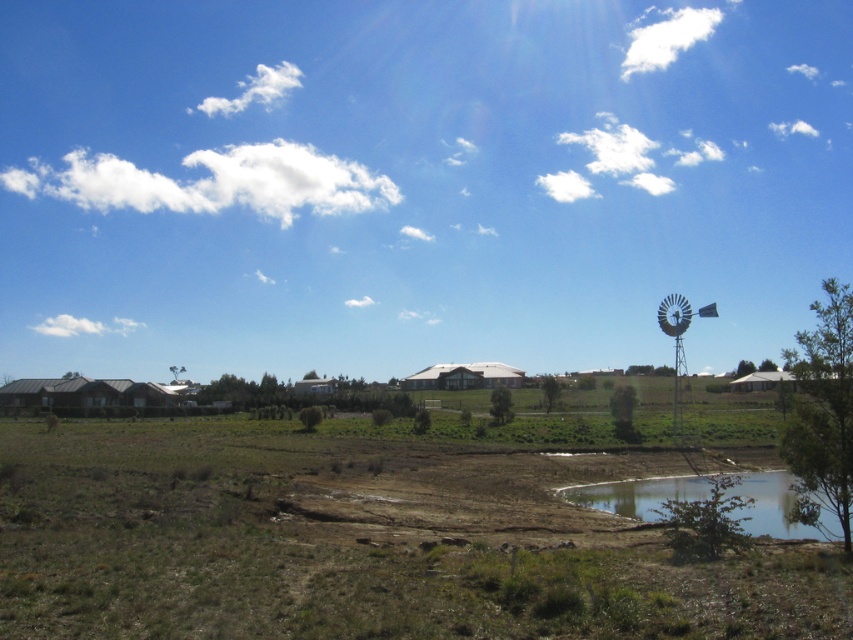
Consider the image. Between green grassy field at center and clear glass pond at lower right, which one is positioned lower?

green grassy field at center

This screenshot has width=853, height=640. Find the location of `green grassy field at center`. green grassy field at center is located at coordinates (358, 541).